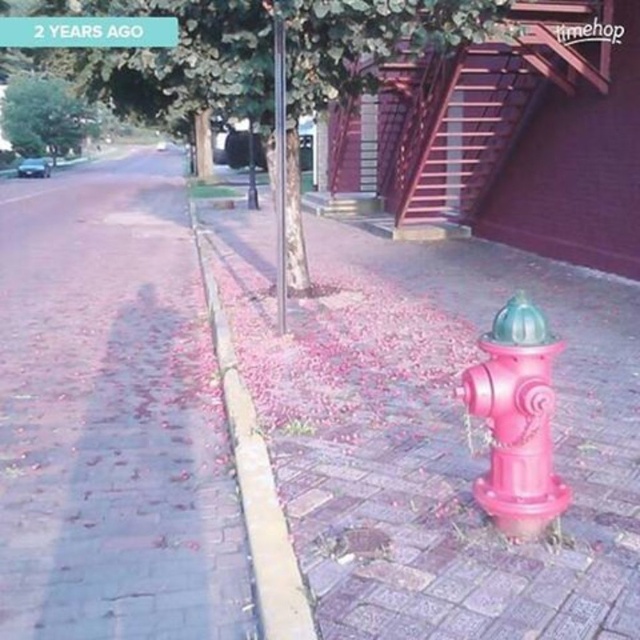
Question: Among these points, which one is farthest from the camera?

Choices:
 (A) click(401, 216)
 (B) click(156, 35)

Answer: (A)

Question: Can you confirm if pink matte fire hydrant at lower right is positioned above brick pavement at lower left?

Choices:
 (A) no
 (B) yes

Answer: (A)

Question: Which of the following is the farthest from the observer?

Choices:
 (A) green plastic sign at upper left
 (B) green leafy tree at upper left

Answer: (B)

Question: Which point appears closest to the camera in this image?

Choices:
 (A) (141, 563)
 (B) (308, 451)

Answer: (A)

Question: Does green leafy tree at center have a smaller size compared to green plastic sign at upper left?

Choices:
 (A) yes
 (B) no

Answer: (A)

Question: Does pink matte hydrant at lower right appear over green plastic sign at upper left?

Choices:
 (A) no
 (B) yes

Answer: (A)